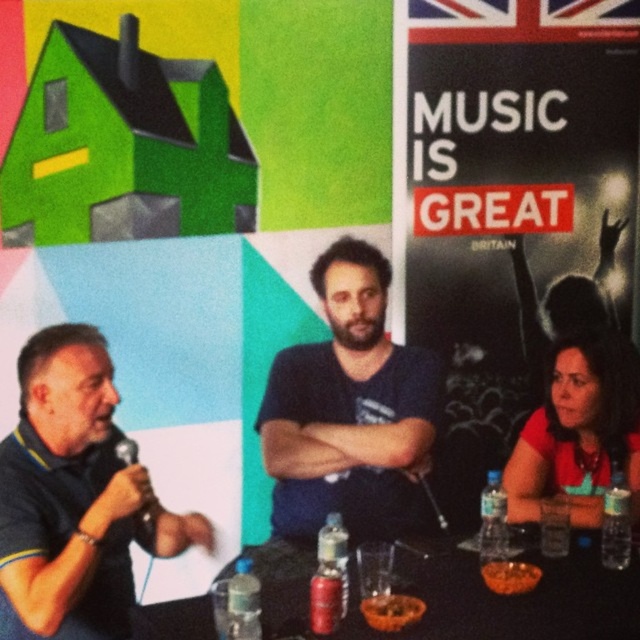
Question: Does matte blue polo shirt at left lie in front of black metallic microphone at left?

Choices:
 (A) no
 (B) yes

Answer: (B)

Question: Which of these objects is positioned farthest from the black metallic microphone at left?

Choices:
 (A) matte blue polo shirt at left
 (B) black plastic table at lower center

Answer: (B)

Question: Does matte blue polo shirt at left appear on the right side of black plastic table at lower center?

Choices:
 (A) yes
 (B) no

Answer: (B)

Question: Considering the real-world distances, which object is farthest from the black metallic microphone at left?

Choices:
 (A) matte blue polo shirt at left
 (B) matte red shirt at lower right
 (C) black plastic table at lower center

Answer: (B)

Question: Estimate the real-world distances between objects in this image. Which object is farther from the dark blue t-shirt at center?

Choices:
 (A) black plastic table at lower center
 (B) matte blue polo shirt at left
 (C) matte red shirt at lower right

Answer: (A)

Question: Does matte red shirt at lower right appear under black metallic microphone at left?

Choices:
 (A) yes
 (B) no

Answer: (B)